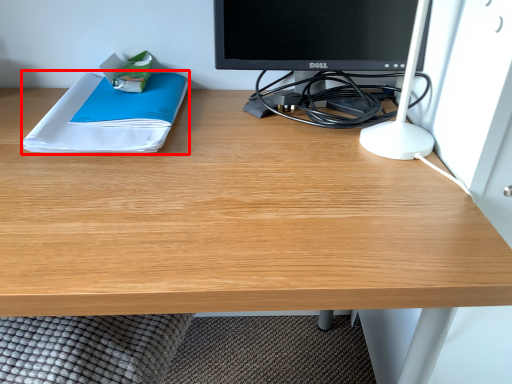
Question: From the image, what is the correct spatial relationship of paperback book (annotated by the red box) in relation to desktop computer?

Choices:
 (A) right
 (B) left

Answer: (B)